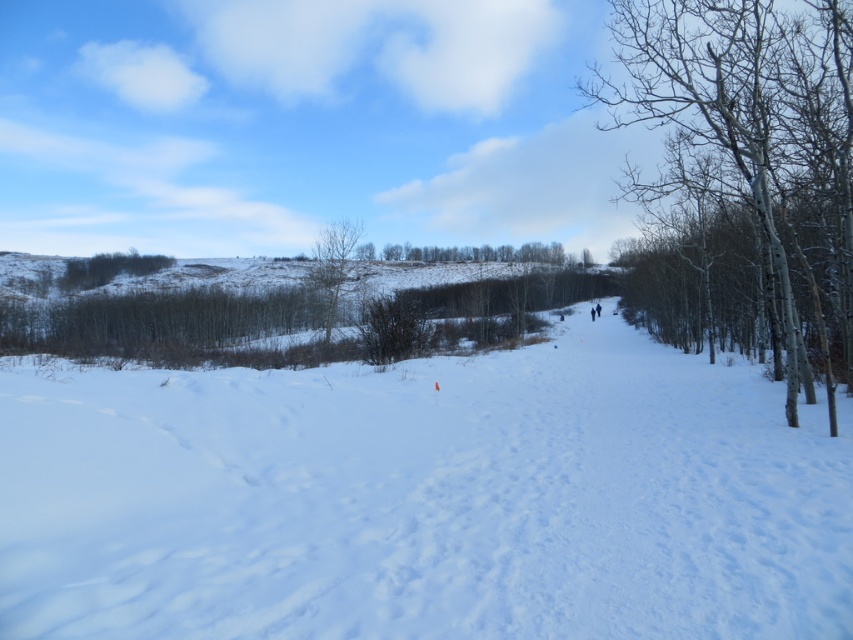
You are standing on the snow path and see the bare white tree at right and the bare branches at center. Which one is closer to your right side?

The bare white tree at right is closer to your right side because it is positioned to the right of the bare branches at center.

You are standing at the center of the snow path and want to walk towards the bare white tree at right. Which direction should you walk?

You should walk towards the right direction to reach the bare white tree at right since it is located at the right side of the scene.

You are standing on the snow path and want to take a photo of both the bare white tree at right and the green leafless tree at center. Which tree should you focus on first to ensure both are in the frame?

You should focus on the green leafless tree at center first because the bare white tree at right is located above it, so adjusting the camera angle to include the higher positioned tree will naturally include the lower one in the frame.